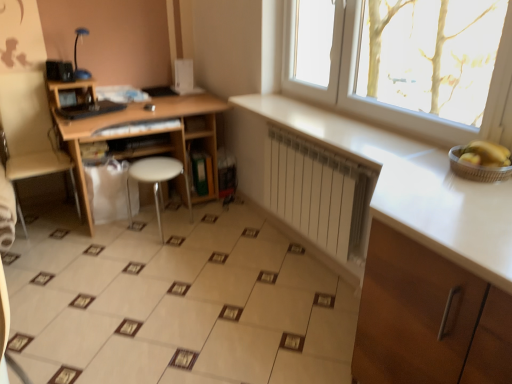
The height and width of the screenshot is (384, 512). Identify the location of empty space that is ontop of beige ceramic tile at center (from a real-world perspective). (170, 288).